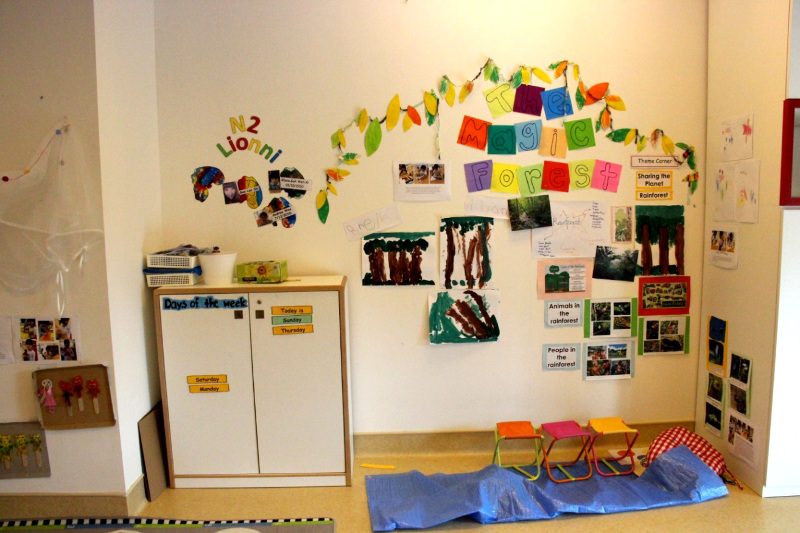
The image size is (800, 533). I want to click on wall, so click(x=57, y=70), click(x=340, y=125).